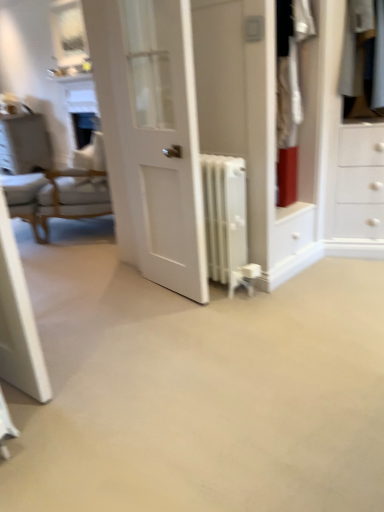
This screenshot has height=512, width=384. I want to click on free space in front of white glossy door at center, so click(x=164, y=323).